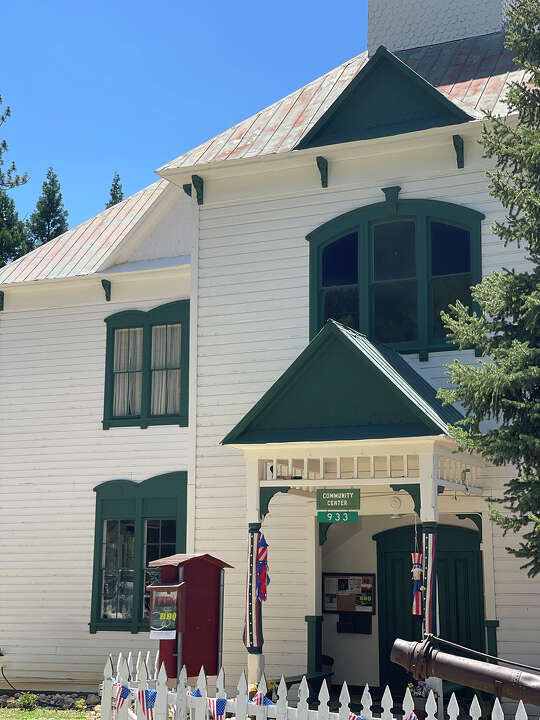
The height and width of the screenshot is (720, 540). I want to click on bulletin board, so click(x=340, y=585).